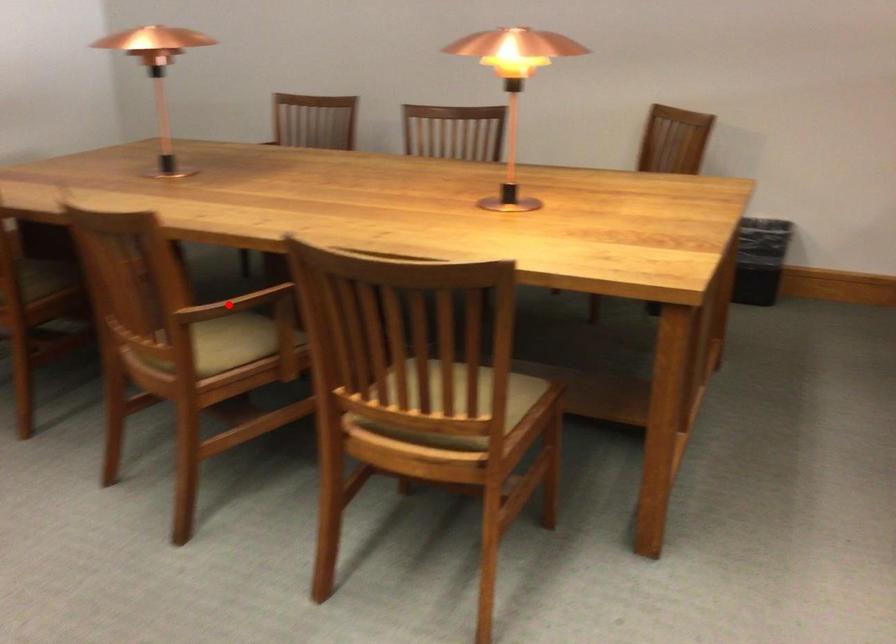
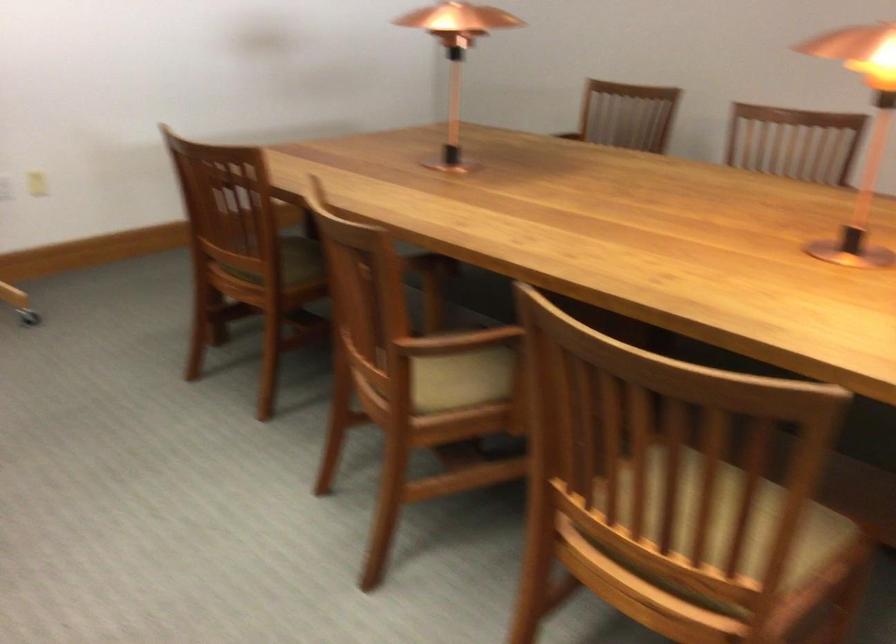
Question: I am providing you with two images of the same scene from different viewpoints. In image1, a red point is highlighted. Considering the same 3D point in image2, which of the following is correct?

Choices:
 (A) It is closer
 (B) It is farther

Answer: (A)